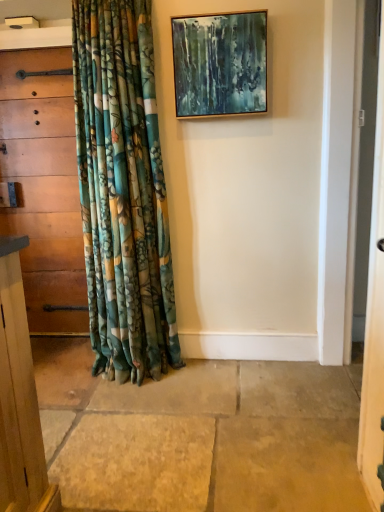
This screenshot has height=512, width=384. I want to click on wooden picture frame at upper center, so click(x=220, y=64).

Based on the photo, what is the approximate width of wooden picture frame at upper center?

3.66 inches.

Describe the element at coordinates (220, 64) in the screenshot. I see `wooden picture frame at upper center` at that location.

This screenshot has width=384, height=512. Describe the element at coordinates (43, 185) in the screenshot. I see `wooden chest of drawers at left` at that location.

The height and width of the screenshot is (512, 384). What are the coordinates of `wooden chest of drawers at left` in the screenshot? It's located at (43, 185).

The height and width of the screenshot is (512, 384). In order to click on wooden picture frame at upper center in this screenshot , I will do `click(220, 64)`.

Considering the relative positions of wooden chest of drawers at left and wooden picture frame at upper center in the image provided, is wooden chest of drawers at left to the left or to the right of wooden picture frame at upper center?

Clearly, wooden chest of drawers at left is on the left of wooden picture frame at upper center in the image.

Which object is further away from the camera, wooden chest of drawers at left or wooden picture frame at upper center?

Positioned behind is wooden chest of drawers at left.

Considering the points (51, 118) and (227, 82), which point is in front, point (51, 118) or point (227, 82)?

The point (227, 82) is in front.

From the image's perspective, would you say wooden chest of drawers at left is positioned over wooden picture frame at upper center?

No, from the image's perspective, wooden chest of drawers at left is not over wooden picture frame at upper center.

From a real-world perspective, is wooden chest of drawers at left physically above wooden picture frame at upper center?

Actually, wooden chest of drawers at left is physically below wooden picture frame at upper center in the real world.

Can you confirm if wooden chest of drawers at left is thinner than wooden picture frame at upper center?

No, wooden chest of drawers at left is not thinner than wooden picture frame at upper center.

Is wooden chest of drawers at left taller than wooden picture frame at upper center?

Yes, wooden chest of drawers at left is taller than wooden picture frame at upper center.

Does wooden chest of drawers at left have a smaller size compared to wooden picture frame at upper center?

Actually, wooden chest of drawers at left might be larger than wooden picture frame at upper center.

Is wooden chest of drawers at left not within wooden picture frame at upper center?

wooden chest of drawers at left is positioned outside wooden picture frame at upper center.

Is wooden chest of drawers at left positioned far away from wooden picture frame at upper center?

wooden chest of drawers at left is positioned a significant distance from wooden picture frame at upper center.

Is wooden chest of drawers at left aimed at wooden picture frame at upper center?

No, wooden chest of drawers at left is not oriented towards wooden picture frame at upper center.

Can you tell me how much wooden chest of drawers at left and wooden picture frame at upper center differ in facing direction?

The angle between the facing direction of wooden chest of drawers at left and the facing direction of wooden picture frame at upper center is 0.711 degrees.

Identify the location of picture frame on the right of the wooden chest of drawers at left. (220, 64).

Is wooden picture frame at upper center at the right side of wooden chest of drawers at left?

Yes.

Which is in front, wooden picture frame at upper center or wooden chest of drawers at left?

wooden picture frame at upper center.

Does point (178, 90) come behind point (34, 136)?

That is False.

From the image's perspective, between wooden picture frame at upper center and wooden chest of drawers at left, who is located below?

wooden chest of drawers at left is shown below in the image.

From a real-world perspective, is wooden picture frame at upper center over wooden chest of drawers at left?

Correct, in the physical world, wooden picture frame at upper center is higher than wooden chest of drawers at left.

Can you confirm if wooden picture frame at upper center is wider than wooden chest of drawers at left?

No.

Based on the photo, is wooden picture frame at upper center taller than wooden chest of drawers at left?

Incorrect, the height of wooden picture frame at upper center is not larger of that of wooden chest of drawers at left.

Considering the relative sizes of wooden picture frame at upper center and wooden chest of drawers at left in the image provided, is wooden picture frame at upper center bigger than wooden chest of drawers at left?

Actually, wooden picture frame at upper center might be smaller than wooden chest of drawers at left.

Is wooden chest of drawers at left surrounded by wooden picture frame at upper center?

Definitely not — wooden chest of drawers at left is not inside wooden picture frame at upper center.

Consider the image. Is wooden picture frame at upper center not close to wooden chest of drawers at left?

That's right, there is a large distance between wooden picture frame at upper center and wooden chest of drawers at left.

Is wooden picture frame at upper center facing towards wooden chest of drawers at left?

No, wooden picture frame at upper center is not facing towards wooden chest of drawers at left.

Looking at this image, can you tell me how much wooden picture frame at upper center and wooden chest of drawers at left differ in facing direction?

They differ by 0.711 degrees in their facing directions.

The image size is (384, 512). Find the location of `the chest of drawers below the wooden picture frame at upper center (from a real-world perspective)`. the chest of drawers below the wooden picture frame at upper center (from a real-world perspective) is located at coordinates (43, 185).

The height and width of the screenshot is (512, 384). Find the location of `picture frame lying on the right of wooden chest of drawers at left`. picture frame lying on the right of wooden chest of drawers at left is located at coordinates (220, 64).

At what (x,y) coordinates should I click in order to perform the action: click on the chest of drawers that is behind the wooden picture frame at upper center. Please return your answer as a coordinate pair (x, y). The height and width of the screenshot is (512, 384). Looking at the image, I should click on (43, 185).